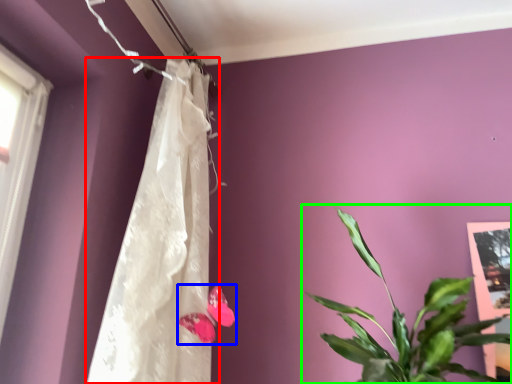
Question: Which object is the closest to the curtain (highlighted by a red box)? Choose among these: flower (highlighted by a blue box) or houseplant (highlighted by a green box).

Choices:
 (A) flower
 (B) houseplant

Answer: (A)